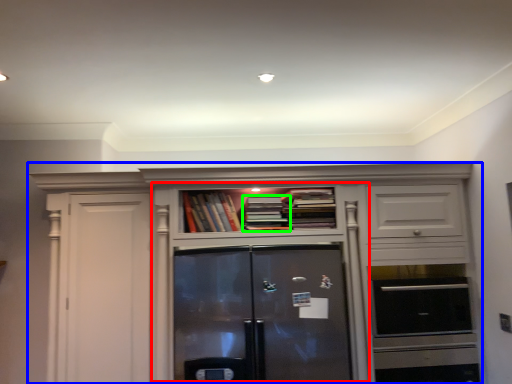
Question: Which object is the closest to the cupboard (highlighted by a red box)? Choose among these: cabinetry (highlighted by a blue box) or book (highlighted by a green box).

Choices:
 (A) cabinetry
 (B) book

Answer: (A)